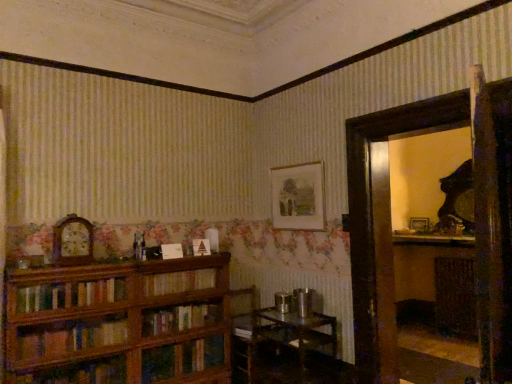
Consider the image. In order to face wooden bookshelf at center, should I rotate leftwards or rightwards?

Rotate left and turn 10.167 degrees.

Locate an element on the screen. This screenshot has height=384, width=512. wooden shelf at right is located at coordinates pyautogui.click(x=455, y=297).

Identify the location of metallic silver table at lower center. The height and width of the screenshot is (384, 512). (295, 333).

Find the location of a particular element. wooden bookcase at left is located at coordinates (120, 323).

The height and width of the screenshot is (384, 512). I want to click on wooden bookshelf at center, so click(179, 282).

Consider the image. Considering the relative sizes of metallic silver table at lower center and wooden picture frame at right, the second picture frame when ordered from front to back, in the image provided, is metallic silver table at lower center bigger than wooden picture frame at right, the second picture frame when ordered from front to back,?

Correct, metallic silver table at lower center is larger in size than wooden picture frame at right, the second picture frame when ordered from front to back.

The height and width of the screenshot is (384, 512). Find the location of `the 1st picture frame above the metallic silver table at lower center (from the image's perspective)`. the 1st picture frame above the metallic silver table at lower center (from the image's perspective) is located at coordinates (419, 224).

Which of these two, metallic silver table at lower center or wooden picture frame at right, the 1th picture frame in the back-to-front sequence, is thinner?

wooden picture frame at right, the 1th picture frame in the back-to-front sequence.

Which of these two, matte paper picture frame at upper center, positioned as the 1th picture frame in top-to-bottom order, or wooden picture frame at right, the second picture frame when ordered from front to back, is wider?

wooden picture frame at right, the second picture frame when ordered from front to back, is wider.

Which object is positioned more to the right, matte paper picture frame at upper center, marked as the second picture frame in a bottom-to-top arrangement, or wooden picture frame at right, the second picture frame when ordered from front to back?

From the viewer's perspective, wooden picture frame at right, the second picture frame when ordered from front to back, appears more on the right side.

Could you tell me if matte paper picture frame at upper center, the first picture frame from the left, is turned towards wooden picture frame at right, the second picture frame when ordered from front to back?

No, matte paper picture frame at upper center, the first picture frame from the left, is not facing towards wooden picture frame at right, the second picture frame when ordered from front to back.

From the picture: From the image's perspective, relative to wooden picture frame at right, which appears as the 1th picture frame when viewed from the right, is matte paper picture frame at upper center, positioned as the 1th picture frame in top-to-bottom order, above or below?

Clearly, from the image's perspective, matte paper picture frame at upper center, positioned as the 1th picture frame in top-to-bottom order, is above wooden picture frame at right, which appears as the 1th picture frame when viewed from the right.

From a real-world perspective, count 2nd picture frames upward from the wooden bookcase at left and point to it. Please provide its 2D coordinates.

[(298, 197)]

Does wooden bookcase at left appear on the right side of matte paper picture frame at upper center, arranged as the second picture frame when viewed from the back?

No.

Is wooden bookcase at left far away from matte paper picture frame at upper center, positioned as the 1th picture frame in top-to-bottom order?

Absolutely, wooden bookcase at left is distant from matte paper picture frame at upper center, positioned as the 1th picture frame in top-to-bottom order.

From the picture: Who is smaller, wooden bookshelf at center or matte paper picture frame at upper center, positioned as the 1th picture frame in top-to-bottom order?

Smaller between the two is matte paper picture frame at upper center, positioned as the 1th picture frame in top-to-bottom order.

Is wooden bookshelf at center facing away from matte paper picture frame at upper center, arranged as the second picture frame when viewed from the back?

wooden bookshelf at center is not turned away from matte paper picture frame at upper center, arranged as the second picture frame when viewed from the back.

How many degrees apart are the facing directions of wooden bookshelf at center and matte paper picture frame at upper center, arranged as the second picture frame when viewed from the back?

The angle between the facing direction of wooden bookshelf at center and the facing direction of matte paper picture frame at upper center, arranged as the second picture frame when viewed from the back, is 89.5 degrees.

Between wooden bookshelf at center and matte paper picture frame at upper center, positioned as the 1th picture frame in top-to-bottom order, which one has smaller width?

Thinner between the two is matte paper picture frame at upper center, positioned as the 1th picture frame in top-to-bottom order.

Considering the sizes of objects wooden bookshelf at center and metallic silver table at lower center in the image provided, who is wider, wooden bookshelf at center or metallic silver table at lower center?

metallic silver table at lower center is wider.

You are a GUI agent. You are given a task and a screenshot of the screen. Output one action in this format:
    pyautogui.click(x=<x>, y=<y>)
    Task: Click on the book above the metallic silver table at lower center (from the image's perspective)
    
    Given the screenshot: What is the action you would take?
    pyautogui.click(x=179, y=282)

From the image's perspective, is wooden bookshelf at center over metallic silver table at lower center?

Yes, from the image's perspective, wooden bookshelf at center is above metallic silver table at lower center.

Which is in front, point (168, 279) or point (254, 336)?

The point (168, 279) is closer to the camera.

In the scene shown: Is wooden shelf at right positioned with its back to wooden bookshelf at center?

No, wooden shelf at right's orientation is not away from wooden bookshelf at center.

From the image's perspective, which one is positioned higher, wooden shelf at right or wooden bookshelf at center?

wooden bookshelf at center, from the image's perspective.

Considering the sizes of objects wooden shelf at right and wooden bookshelf at center in the image provided, who is bigger, wooden shelf at right or wooden bookshelf at center?

wooden shelf at right.

From the picture: Considering the relative sizes of wooden picture frame at right, the second picture frame when ordered from front to back, and wooden clock at left in the image provided, is wooden picture frame at right, the second picture frame when ordered from front to back, shorter than wooden clock at left?

Correct, wooden picture frame at right, the second picture frame when ordered from front to back, is not as tall as wooden clock at left.

In the scene shown: Is wooden picture frame at right, the second picture frame when ordered from front to back, surrounding wooden clock at left?

No, wooden picture frame at right, the second picture frame when ordered from front to back, does not contain wooden clock at left.

Which of these two, wooden picture frame at right, which is the second picture frame from left to right, or wooden clock at left, is thinner?

wooden picture frame at right, which is the second picture frame from left to right, is thinner.

Is point (426, 220) closer to camera compared to point (60, 231)?

That is False.

Identify the location of picture frame that is the 1st object located above the metallic silver table at lower center (from the image's perspective). This screenshot has height=384, width=512. (419, 224).

You are a GUI agent. You are given a task and a screenshot of the screen. Output one action in this format:
    pyautogui.click(x=<x>, y=<y>)
    Task: Click on the picture frame that appears below the matte paper picture frame at upper center, positioned as the 1th picture frame in top-to-bottom order (from a real-world perspective)
    The height and width of the screenshot is (384, 512).
    Given the screenshot: What is the action you would take?
    pyautogui.click(x=419, y=224)

When comparing their distances from matte paper picture frame at upper center, the first picture frame from the left, does wooden bookshelf at center or matte white mantel at upper right seem further?

matte white mantel at upper right lies further to matte paper picture frame at upper center, the first picture frame from the left, than the other object.

From the image, which object appears to be farther from wooden shelf at right, matte paper picture frame at upper center, the 2th picture frame positioned from the right, or wooden clock at left?

wooden clock at left lies further to wooden shelf at right than the other object.

Looking at the image, which one is located closer to matte white mantel at upper right, wooden bookcase at left or matte paper picture frame at upper center, arranged as the second picture frame when viewed from the back?

Based on the image, matte paper picture frame at upper center, arranged as the second picture frame when viewed from the back, appears to be nearer to matte white mantel at upper right.

Based on their spatial positions, is wooden bookshelf at center or wooden clock at left closer to matte paper picture frame at upper center, marked as the second picture frame in a bottom-to-top arrangement?

wooden bookshelf at center is positioned closer to the anchor matte paper picture frame at upper center, marked as the second picture frame in a bottom-to-top arrangement.

When comparing their distances from matte white mantel at upper right, does wooden bookshelf at center or wooden shelf at right seem closer?

wooden shelf at right lies closer to matte white mantel at upper right than the other object.

From the image, which object appears to be nearer to wooden picture frame at right, the 1th picture frame in the back-to-front sequence, wooden shelf at right or wooden bookcase at left?

wooden shelf at right is closer to wooden picture frame at right, the 1th picture frame in the back-to-front sequence.

When comparing their distances from matte paper picture frame at upper center, positioned as the 1th picture frame in top-to-bottom order, does wooden picture frame at right, the second picture frame when ordered from front to back, or matte white mantel at upper right seem further?

Based on the image, wooden picture frame at right, the second picture frame when ordered from front to back, appears to be further to matte paper picture frame at upper center, positioned as the 1th picture frame in top-to-bottom order.

Which object lies nearer to the anchor point wooden clock at left, metallic silver table at lower center or wooden picture frame at right, the 1th picture frame in the back-to-front sequence?

The object closer to wooden clock at left is metallic silver table at lower center.

Locate an element on the screen. mantle between metallic silver table at lower center and wooden picture frame at right, the second picture frame when ordered from front to back, in the front-back direction is located at coordinates (432, 239).

Find the location of a particular element. This screenshot has height=384, width=512. book between wooden clock at left and wooden bookcase at left vertically is located at coordinates (179, 282).

I want to click on table between wooden clock at left and wooden shelf at right, so click(295, 333).

The height and width of the screenshot is (384, 512). I want to click on mantle between wooden clock at left and wooden shelf at right, so click(x=432, y=239).